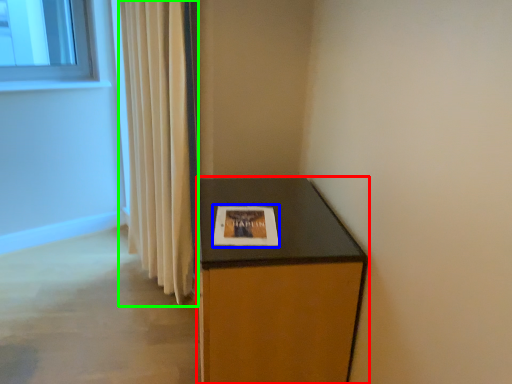
Question: Estimate the real-world distances between objects in this image. Which object is farther from furniture (highlighted by a red box), picture frame (highlighted by a blue box) or curtain (highlighted by a green box)?

Choices:
 (A) picture frame
 (B) curtain

Answer: (B)